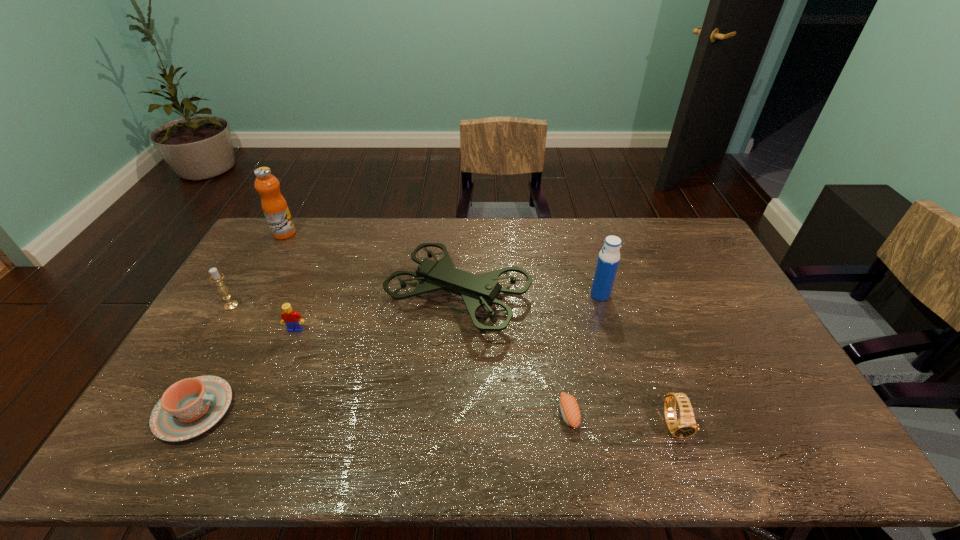
I want to click on sushi located in the near edge section of the desktop, so click(x=569, y=408).

The image size is (960, 540). In order to click on fruit juice present at the left edge in this screenshot , I will do `click(275, 208)`.

Find the location of a particular element. Image resolution: width=960 pixels, height=540 pixels. candle holder that is at the left edge is located at coordinates (216, 277).

Locate an element on the screen. The height and width of the screenshot is (540, 960). chinaware present at the left edge is located at coordinates (188, 408).

At what (x,y) coordinates should I click in order to perform the action: click on object that is at the far left corner. Please return your answer as a coordinate pair (x, y). This screenshot has height=540, width=960. Looking at the image, I should click on (275, 208).

The image size is (960, 540). I want to click on object located at the near left corner, so click(x=188, y=408).

At what (x,y) coordinates should I click in order to perform the action: click on blank area at the far edge. Please return your answer as a coordinate pair (x, y). The height and width of the screenshot is (540, 960). Looking at the image, I should click on (331, 247).

At what (x,y) coordinates should I click in order to perform the action: click on vacant space at the right edge of the desktop. Please return your answer as a coordinate pair (x, y). Looking at the image, I should click on (685, 271).

Where is `free space between the fourth object from right to left and the chinaware`? The height and width of the screenshot is (540, 960). free space between the fourth object from right to left and the chinaware is located at coordinates (326, 354).

Find the location of a particular element. This screenshot has height=540, width=960. vacant area that lies between the shortest object and the fourth object from right to left is located at coordinates (514, 355).